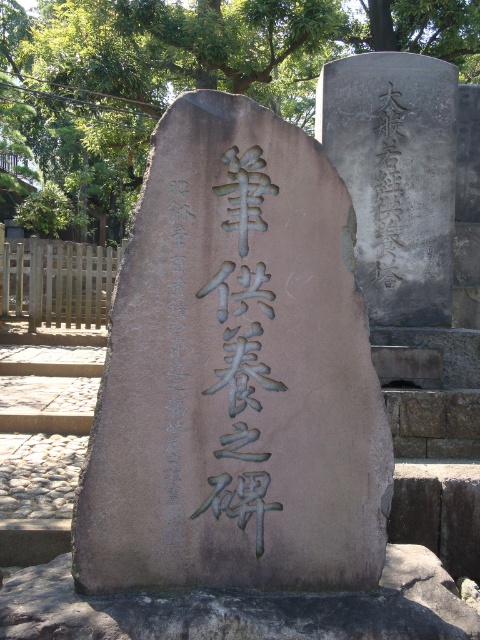
Does smooth gray stone at upper right appear under black stone inscription at center?

Actually, smooth gray stone at upper right is above black stone inscription at center.

Can you confirm if smooth gray stone at upper right is positioned above black stone inscription at center?

Correct, smooth gray stone at upper right is located above black stone inscription at center.

What do you see at coordinates (396, 177) in the screenshot?
I see `smooth gray stone at upper right` at bounding box center [396, 177].

Find the location of a particular element. This screenshot has height=640, width=480. smooth gray stone at upper right is located at coordinates (396, 177).

Does brown polished stone monument at center have a greater height compared to smooth gray stone at upper right?

No.

Which is below, brown polished stone monument at center or smooth gray stone at upper right?

Positioned lower is brown polished stone monument at center.

What do you see at coordinates (236, 372) in the screenshot? I see `brown polished stone monument at center` at bounding box center [236, 372].

Identify the location of brown polished stone monument at center. The height and width of the screenshot is (640, 480). (236, 372).

Is brown polished stone monument at center positioned before black stone inscription at center?

Yes, brown polished stone monument at center is closer to the viewer.

Between point (358, 365) and point (178, 280), which one is positioned in front?

Positioned in front is point (178, 280).

Which is in front, point (168, 586) or point (172, 476)?

Positioned in front is point (168, 586).

Identify the location of brown polished stone monument at center. (236, 372).